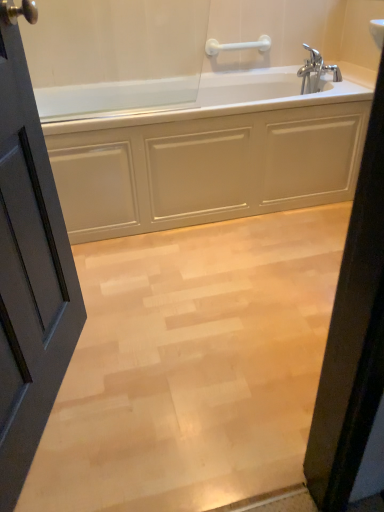
In order to click on empty space that is ontop of light wood floor at center (from a real-world perspective) in this screenshot , I will do `click(213, 310)`.